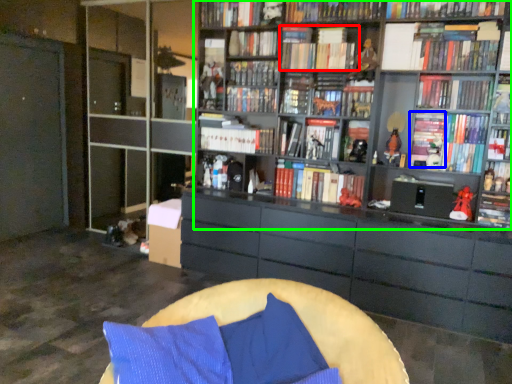
Question: Which object is positioned closest to book (highlighted by a red box)? Select from book (highlighted by a blue box) and bookcase (highlighted by a green box).

Choices:
 (A) book
 (B) bookcase

Answer: (B)